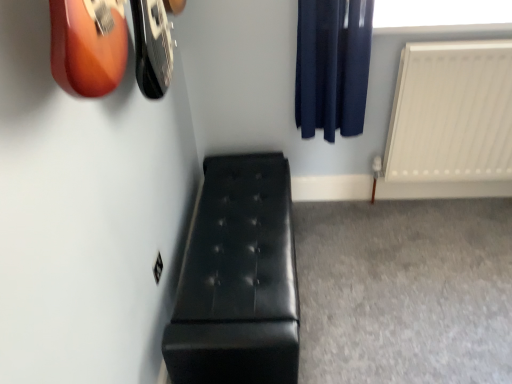
The image size is (512, 384). What are the coordinates of `free point below dark blue fabric curtain at upper right (from a real-world perspective)` in the screenshot? It's located at (336, 208).